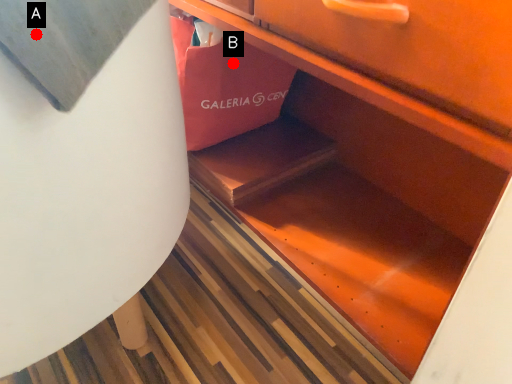
Question: Two points are circled on the image, labeled by A and B beside each circle. Which point is farther from the camera taking this photo?

Choices:
 (A) A is further
 (B) B is further

Answer: (B)